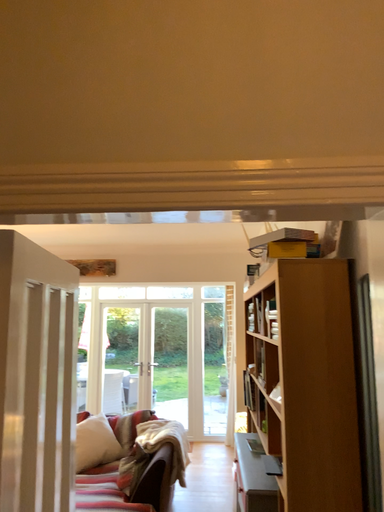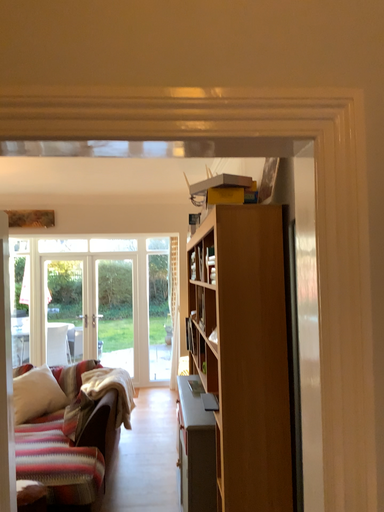
Question: Which way did the camera rotate in the video?

Choices:
 (A) rotated right
 (B) rotated left

Answer: (A)